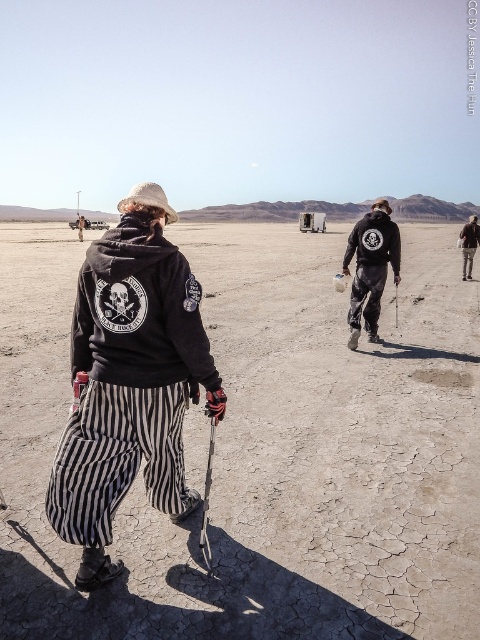
You are standing in the desert scene and want to place a small flag exactly halfway between point (x=130, y=211) and point (x=396, y=314). Will the flag be closer to the first point or the second point?

The flag placed halfway between point (x=130, y=211) and point (x=396, y=314) will be closer to point (x=396, y=314) because it is farther from the viewer compared to point (x=130, y=211).